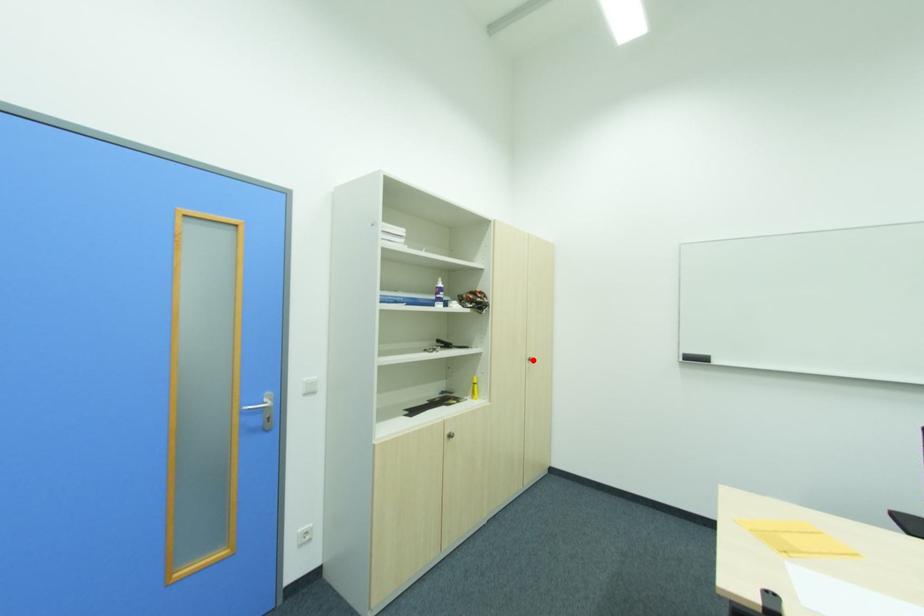
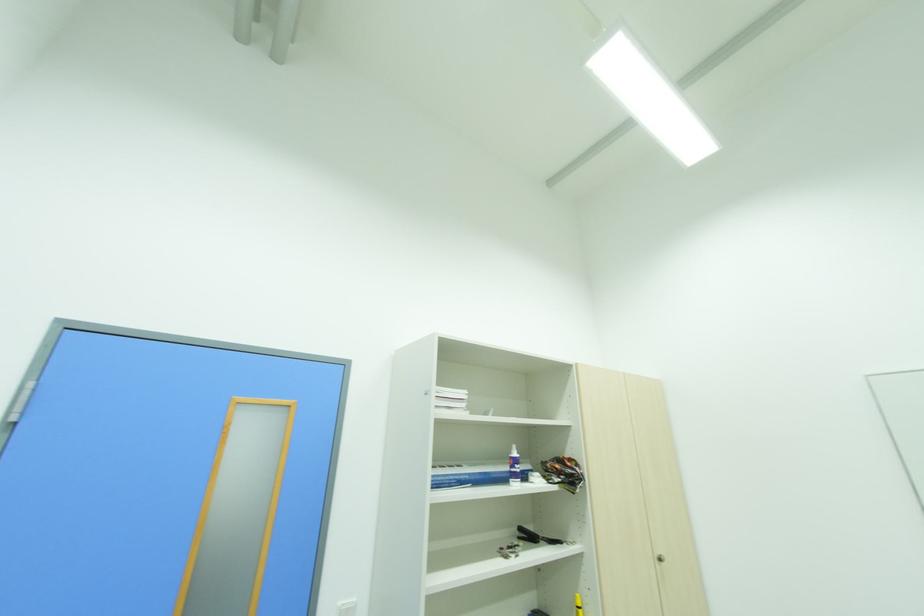
Where in the second image is the point corresponding to the highlighted location from the first image?

(663, 561)